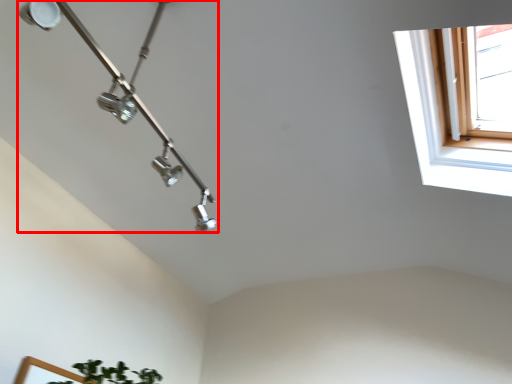
Question: Where is lamp (annotated by the red box) located in relation to window in the image?

Choices:
 (A) right
 (B) left

Answer: (B)